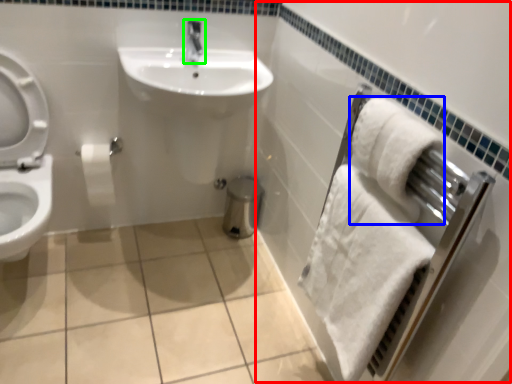
Question: Based on their relative distances, which object is nearer to bath (highlighted by a red box)? Choose from bath towel (highlighted by a blue box) and tap (highlighted by a green box).

Choices:
 (A) bath towel
 (B) tap

Answer: (A)